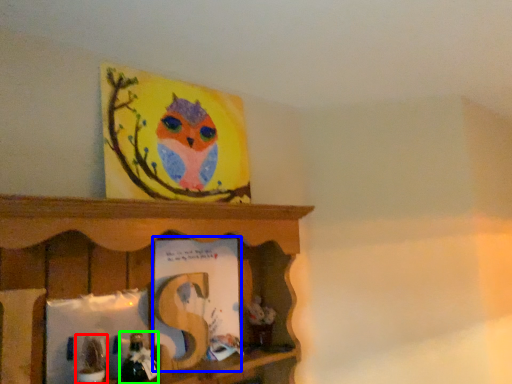
Question: Which is nearer to the toy (highlighted by a red box)? book (highlighted by a blue box) or toy (highlighted by a green box).

Choices:
 (A) book
 (B) toy

Answer: (B)